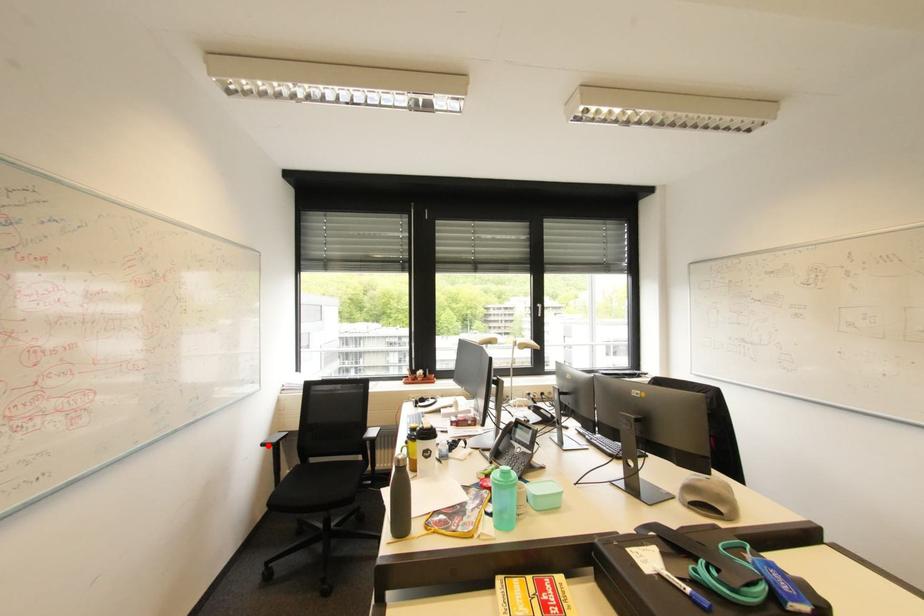
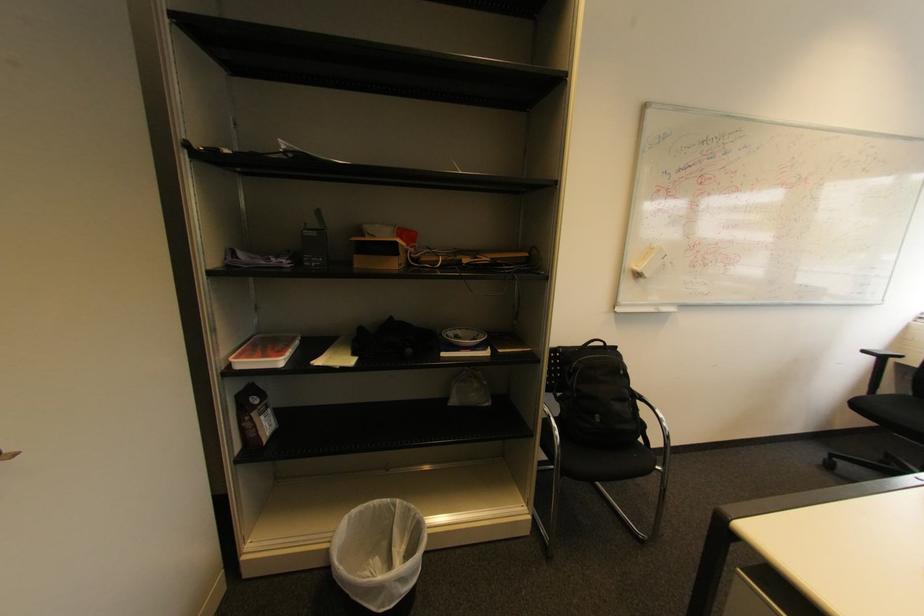
The point at the highlighted location is marked in the first image. Where is the corresponding point in the second image?

(869, 352)